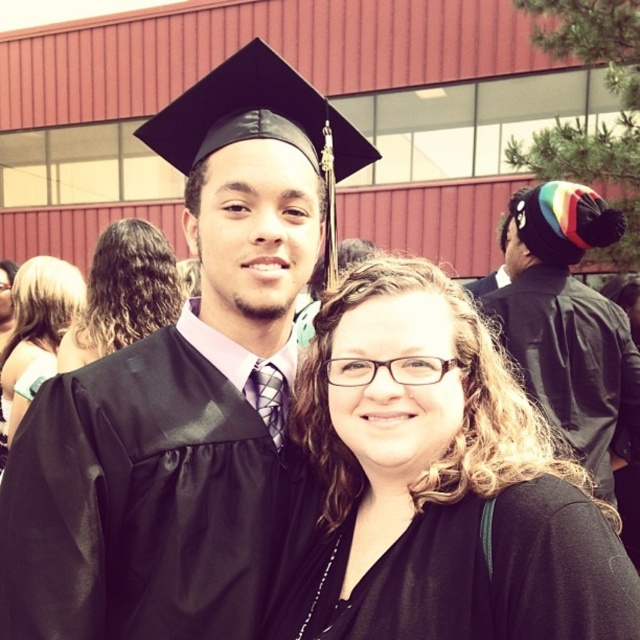
Question: Which object appears closest to the camera in this image?

Choices:
 (A) black matte robe at center
 (B) multicolored knit hat at upper right

Answer: (A)

Question: Which of the following is the closest to the observer?

Choices:
 (A) (35, 556)
 (B) (305, 500)
 (C) (596, 531)

Answer: (C)

Question: Is black matte/black textured hair at center wider than black satin gown at center?

Choices:
 (A) no
 (B) yes

Answer: (B)

Question: Is black matte robe at center positioned in front of blonde hair at center?

Choices:
 (A) no
 (B) yes

Answer: (B)

Question: Does satin black graduation gown at center appear on the right side of black matte robe at center?

Choices:
 (A) no
 (B) yes

Answer: (A)

Question: Based on their relative distances, which object is nearer to the satin black graduation gown at center?

Choices:
 (A) blonde hair at center
 (B) black matte graduation gown at center

Answer: (B)